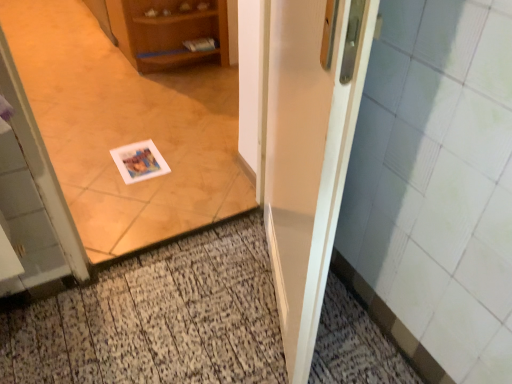
Locate an element on the screen. The image size is (512, 384). vacant area that lies to the right of white paper at center is located at coordinates (233, 259).